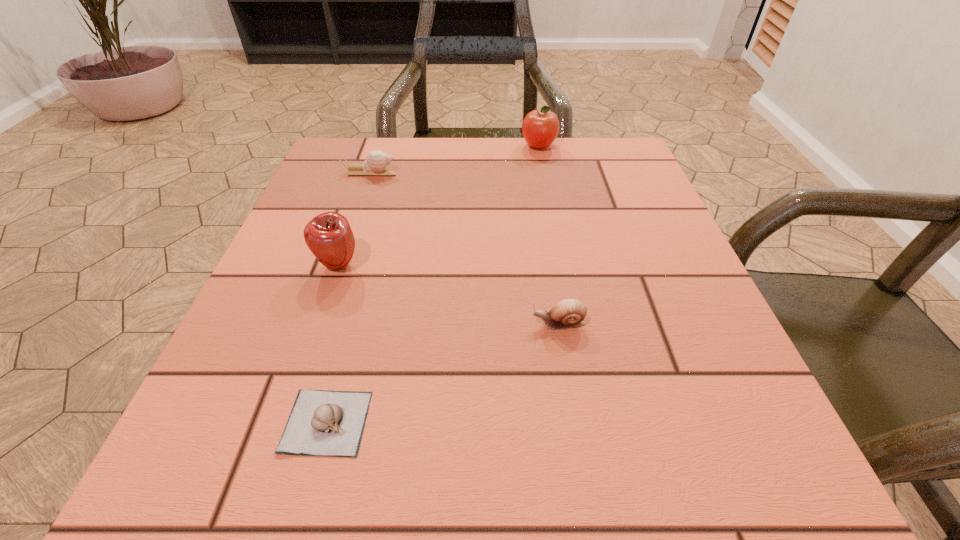
The image size is (960, 540). Identify the location of free space located on the front of the right apple. tap(553, 218).

Image resolution: width=960 pixels, height=540 pixels. I want to click on free space located on the right of the nearer apple, so click(550, 264).

Where is `vacant space located 0.390m on the shell of the fourth nearest object`? The width and height of the screenshot is (960, 540). vacant space located 0.390m on the shell of the fourth nearest object is located at coordinates (572, 172).

The image size is (960, 540). Identify the location of vacant region located on the front-facing side of the second nearest object. (353, 324).

Identify the location of vacant position located 0.310m on the front-facing side of the second nearest object. (327, 324).

Image resolution: width=960 pixels, height=540 pixels. Identify the location of vacant region located 0.110m on the front-facing side of the second nearest object. (459, 324).

Where is `vacant space located 0.240m on the right of the nearest object`? This screenshot has width=960, height=540. vacant space located 0.240m on the right of the nearest object is located at coordinates (558, 422).

You are a GUI agent. You are given a task and a screenshot of the screen. Output one action in this format:
    pyautogui.click(x=<x>, y=<y>)
    Task: Click on the apple at the far edge
    
    Given the screenshot: What is the action you would take?
    pyautogui.click(x=540, y=128)

Image resolution: width=960 pixels, height=540 pixels. In order to click on escargot that is positioned at the far edge in this screenshot , I will do `click(376, 162)`.

The height and width of the screenshot is (540, 960). Identify the location of object at the near edge. (328, 423).